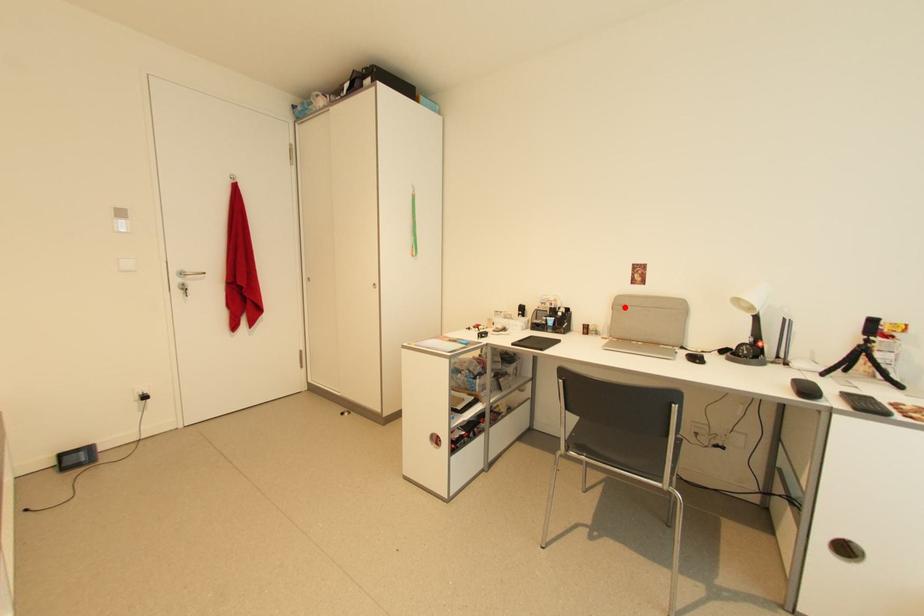
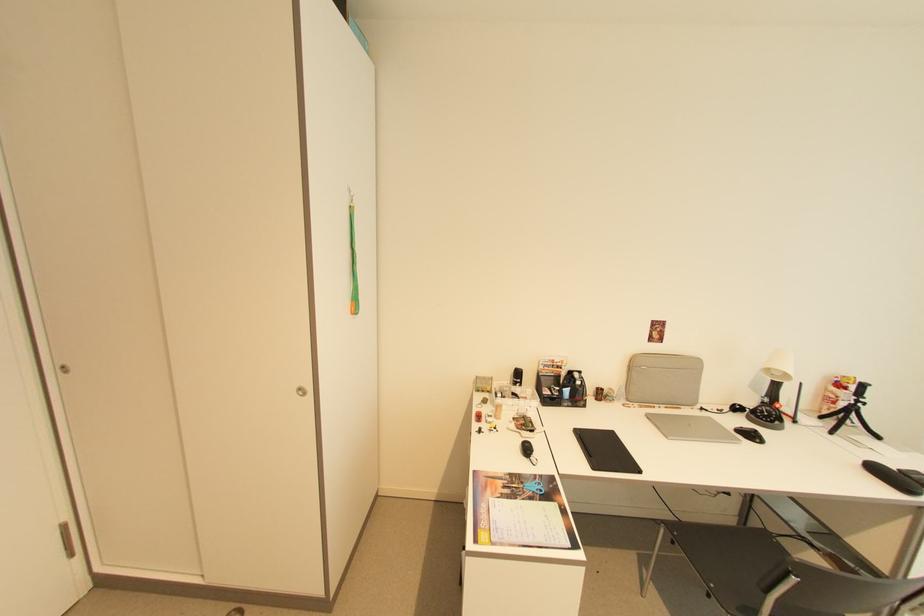
In the second image, find the point that corresponds to the highlighted location in the first image.

(638, 366)